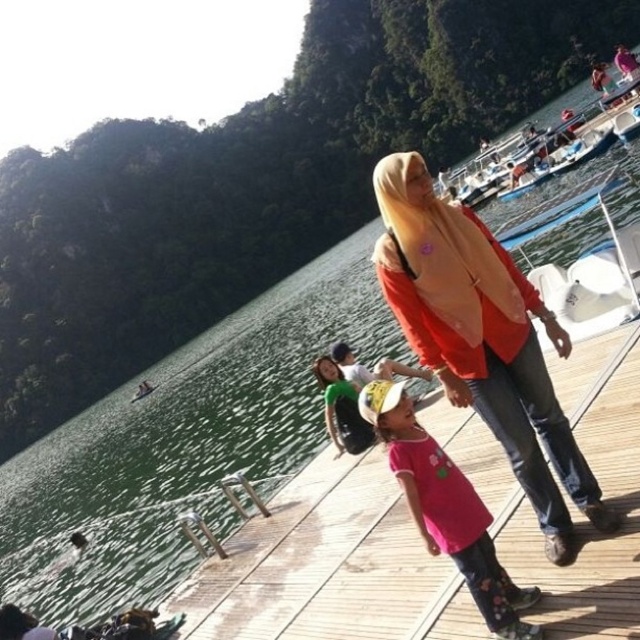
Question: From the image, what is the correct spatial relationship of pink matte t-shirt at center in relation to white cotton shirt at center?

Choices:
 (A) right
 (B) left

Answer: (A)

Question: Which point is closer to the camera?

Choices:
 (A) (435, 548)
 (B) (371, 444)

Answer: (A)

Question: Which object is farther from the camera taking this photo?

Choices:
 (A) white cotton shirt at center
 (B) matte orange sweater at center

Answer: (A)

Question: Which of these objects is positioned farthest from the pink matte t-shirt at center?

Choices:
 (A) white cotton shirt at center
 (B) matte orange sweater at center

Answer: (A)

Question: Can you confirm if matte orange sweater at center is thinner than pink matte t-shirt at center?

Choices:
 (A) no
 (B) yes

Answer: (A)

Question: Can you confirm if matte orange sweater at center is positioned to the left of white cotton shirt at center?

Choices:
 (A) yes
 (B) no

Answer: (B)